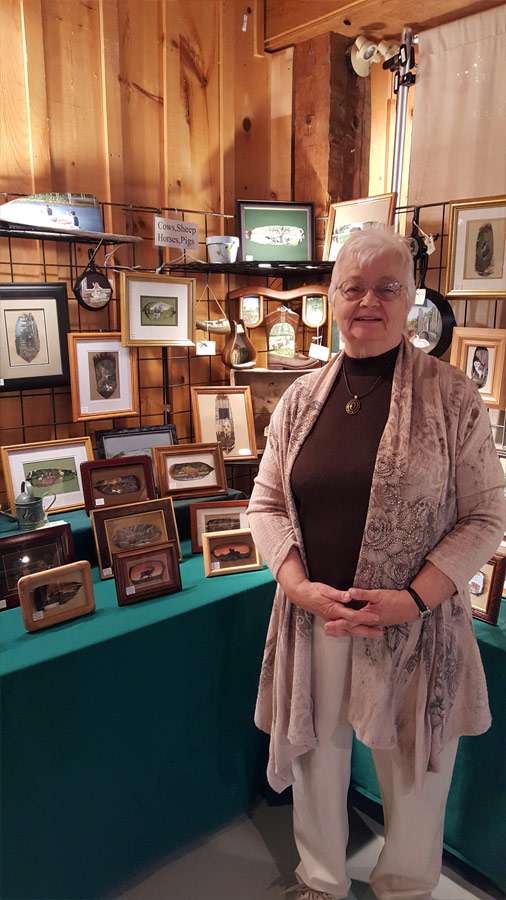
Identify the location of wall. Image resolution: width=506 pixels, height=900 pixels. click(x=486, y=313).